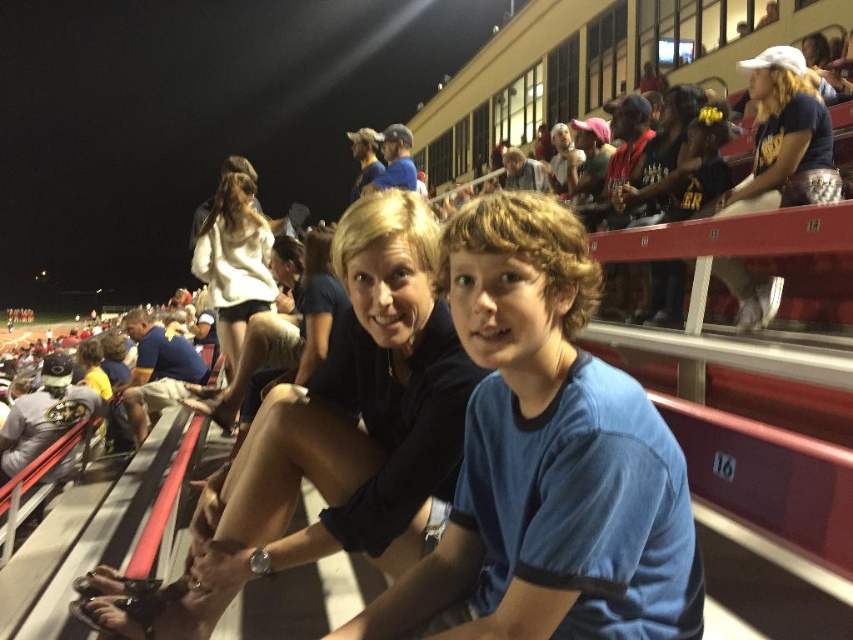
You are trying to decide which item to take from the scene for warmth. The matte black shirt at center and the white soft sweater at upper center are both available. Based on their sizes, which one might be more suitable for keeping warm?

The white soft sweater at upper center is larger in size than the matte black shirt at center, making it more suitable for warmth due to its greater coverage and material thickness.

You are a photographer at the stadium and want to capture a photo of both the blue cotton shirt at center and the matte black shirt at center. Since you can only focus on one shirt at a time, which shirt should you focus on first to ensure the other is still in the frame?

The blue cotton shirt at center is to the right of the matte black shirt at center, so you should focus on the matte black shirt at center first to ensure the blue cotton shirt at center remains in the frame.